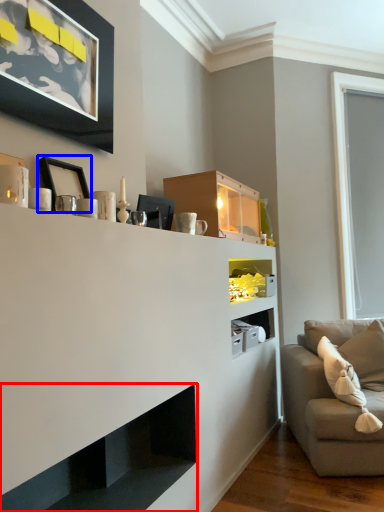
Question: Which point is closer to the camera, shelf (highlighted by a red box) or picture frame (highlighted by a blue box)?

Choices:
 (A) shelf
 (B) picture frame

Answer: (A)